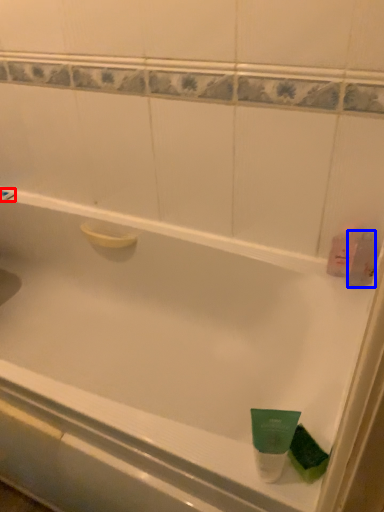
Question: Which point is closer to the camera, shower (highlighted by a red box) or mouthwash (highlighted by a blue box)?

Choices:
 (A) shower
 (B) mouthwash

Answer: (B)